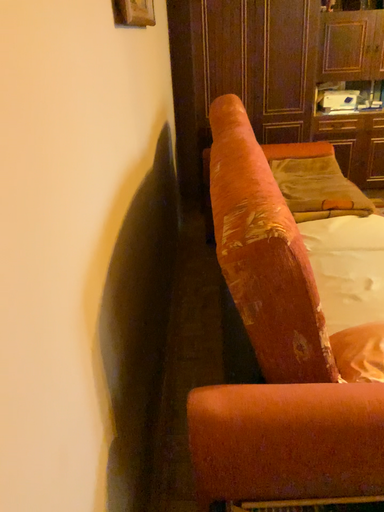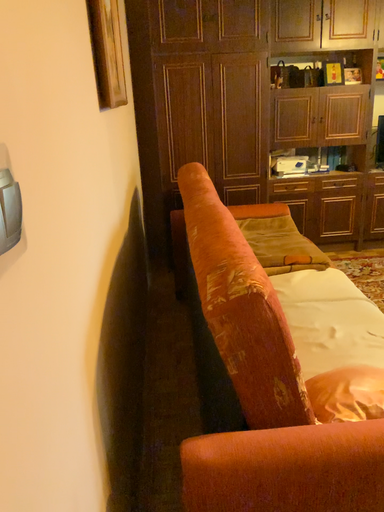
Question: How did the camera likely rotate when shooting the video?

Choices:
 (A) rotated upward
 (B) rotated downward

Answer: (A)